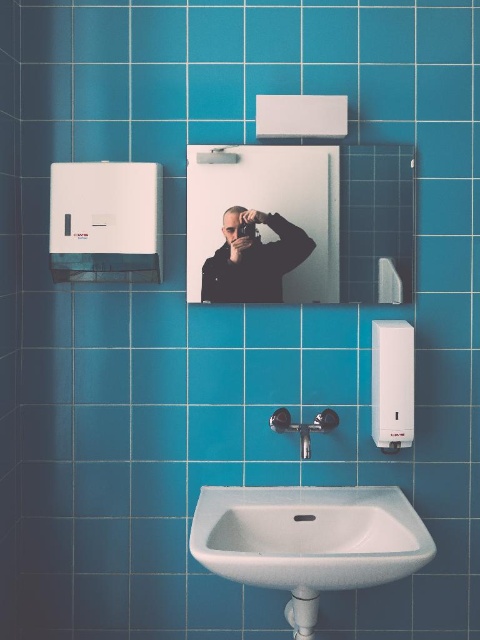
You are trying to hang a new picture frame that is 30 cm wide. You see the clear glass mirror at upper center and the black matte jacket at center. Which object can the frame fit next to without overlapping if placed beside it?

The clear glass mirror at upper center is wider than the black matte jacket at center. Since the picture frame is 30 cm wide, it can fit next to the black matte jacket at center as long as there is enough space. However, the exact placement depends on the available space beside each object.

You are standing in the bathroom and want to wash your hands. Which object, the clear glass mirror at upper center or the white ceramic sink at center, should you approach first?

You should approach the white ceramic sink at center first because it is closer to you than the clear glass mirror at upper center, which is further away.